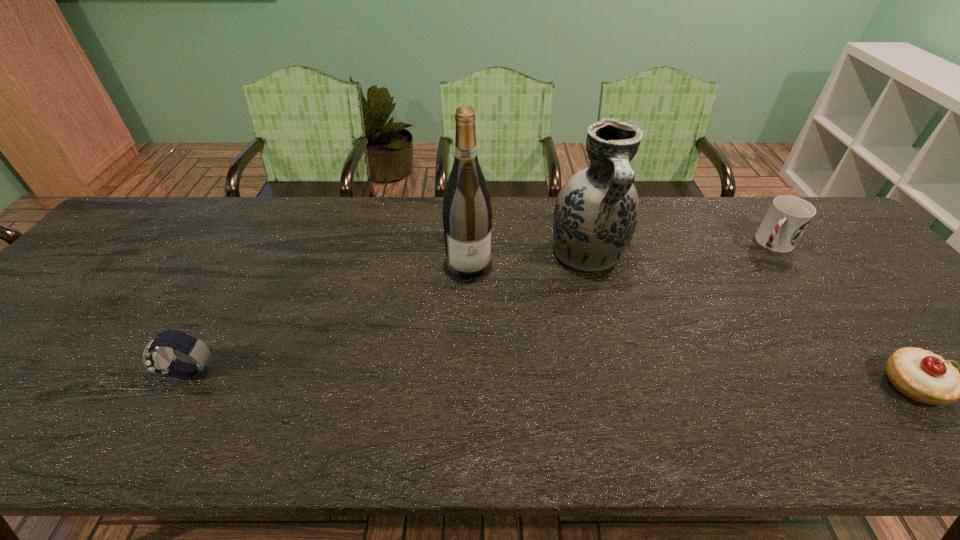
You are a GUI agent. You are given a task and a screenshot of the screen. Output one action in this format:
    pyautogui.click(x=<x>, y=<y>)
    Task: Click on the watch
    Image resolution: width=960 pixels, height=540 pixels.
    Given the screenshot: What is the action you would take?
    pyautogui.click(x=158, y=357)

I want to click on the second tallest object, so click(596, 212).

Locate an element on the screen. The width and height of the screenshot is (960, 540). vase is located at coordinates (596, 212).

Locate an element on the screen. the second object from left to right is located at coordinates (467, 210).

At what (x,y) coordinates should I click in order to perform the action: click on cup. Please return your answer as a coordinate pair (x, y). Looking at the image, I should click on (786, 220).

Find the location of `vacant region located 0.060m on the face of the leftmost object`. vacant region located 0.060m on the face of the leftmost object is located at coordinates (140, 374).

Where is `vacant space located on the face of the leftmost object`? The width and height of the screenshot is (960, 540). vacant space located on the face of the leftmost object is located at coordinates (59, 374).

Find the location of `free space located 0.320m on the face of the leftmost object`. free space located 0.320m on the face of the leftmost object is located at coordinates (22, 374).

This screenshot has width=960, height=540. What are the coordinates of `vacant space located with the handle on the side of the vase` in the screenshot? It's located at (650, 397).

Where is `free space located with the handle on the side of the vase`? The height and width of the screenshot is (540, 960). free space located with the handle on the side of the vase is located at coordinates (612, 309).